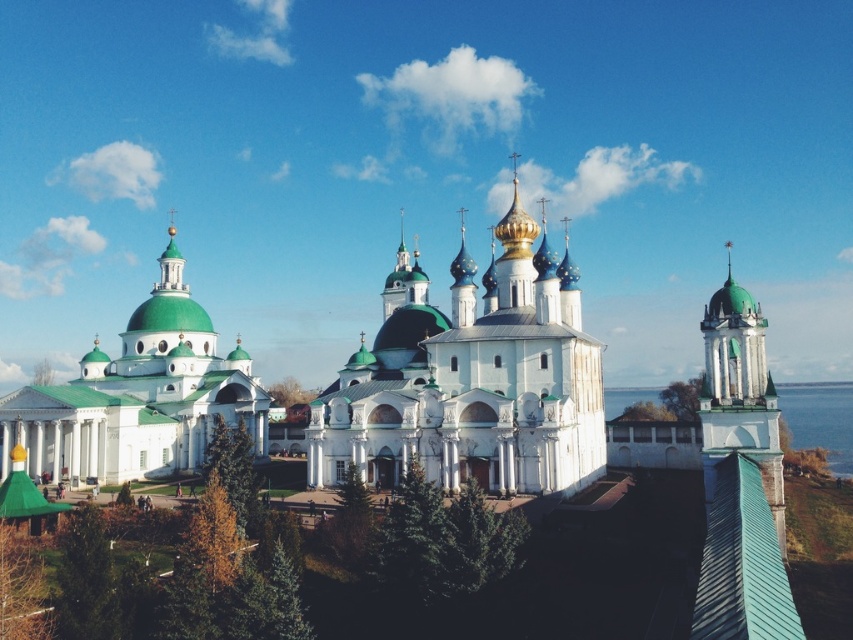
You are planning to take a photo of the white stone church at center and the blue water at tower right. Which object should you focus on first if you want to capture both in a single frame without moving the camera?

The white stone church at center is larger than the blue water at tower right, so focusing on the white stone church at center first would ensure it occupies the main subject position while still allowing the blue water at tower right to be included in the frame.

You are standing at the center of the architectural complex and see a point marked at coordinates (x=740, y=394). What does this point indicate?

The point at coordinates (x=740, y=394) marks the location of the green glazed tower at right.

You are standing at the center of the architectural complex and want to locate the white glossy church at left. According to the coordinates provided, in which direction should you look to find it?

The white glossy church at left is located at coordinates point [138,397], which means it is positioned to the left side of the scene. Therefore, you should look to your left to find it.